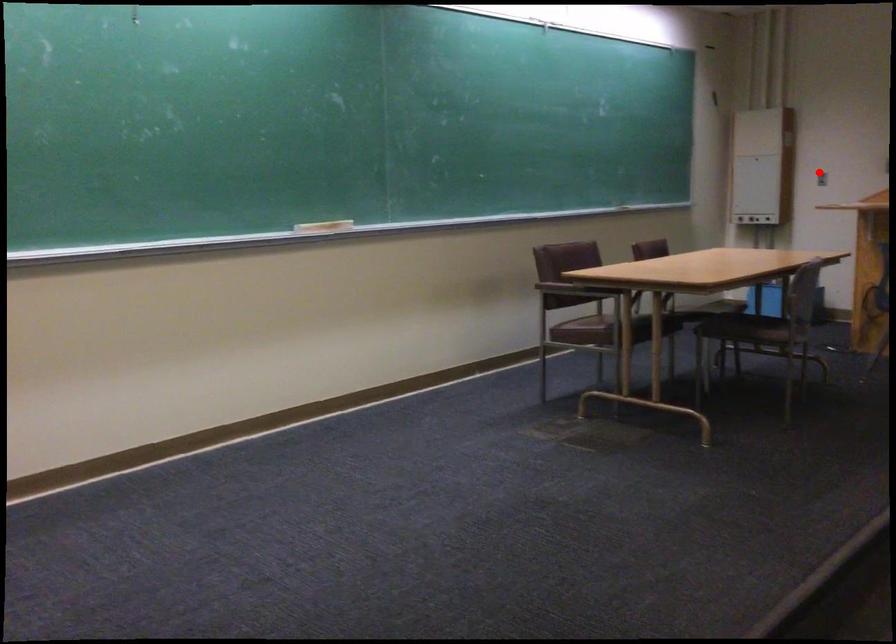
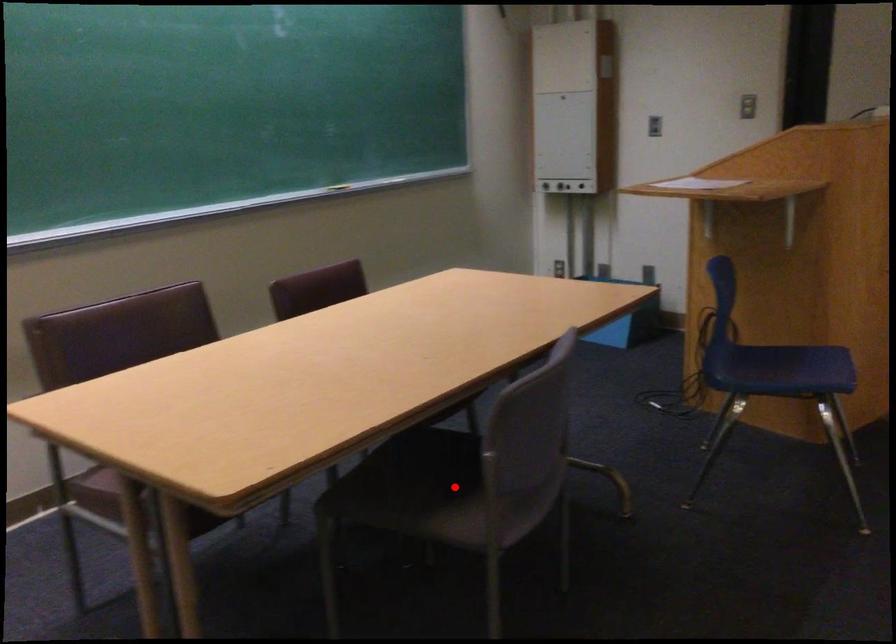
I am providing you with two images of the same scene from different viewpoints. A red point is marked on the first image and another point is marked on the second image. Is the red point in image1 aligned with the point shown in image2?

No